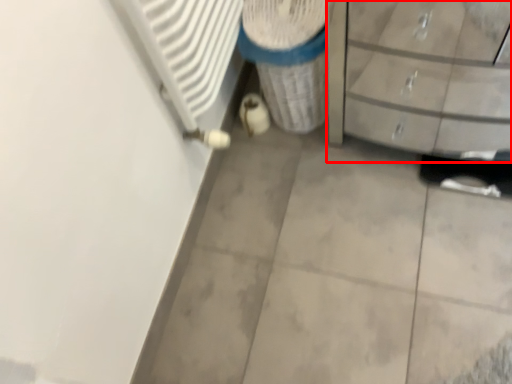
Question: From the image's perspective, where is chest of drawers (annotated by the red box) located relative to recycling bin?

Choices:
 (A) above
 (B) below

Answer: (B)